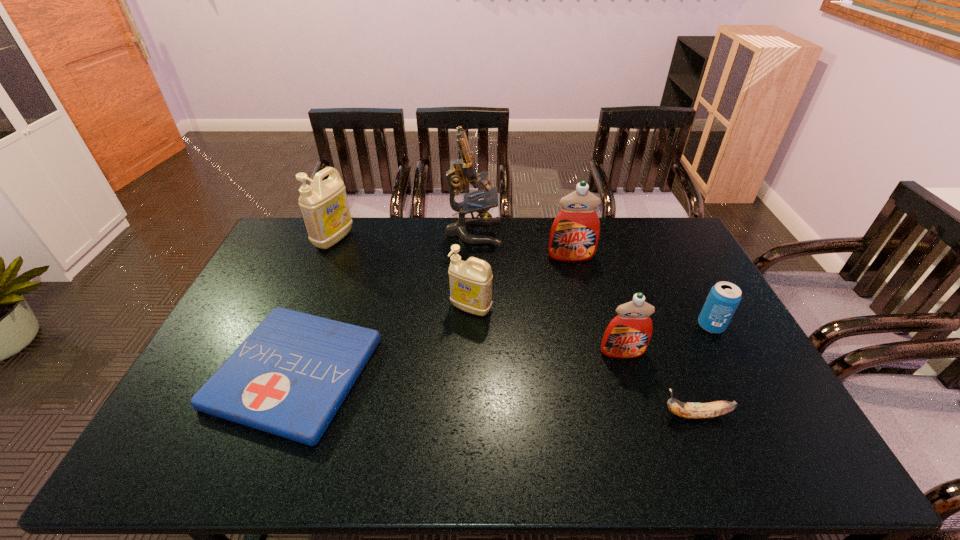
Where is `banana`? This screenshot has height=540, width=960. banana is located at coordinates (710, 409).

The height and width of the screenshot is (540, 960). Find the location of `the shortest object`. the shortest object is located at coordinates (290, 376).

Where is `blue first-aid kit`? blue first-aid kit is located at coordinates (290, 376).

At what (x,y) coordinates should I click in order to perform the action: click on free space located 0.320m at the eyepieces of the tallest object. Please return your answer as a coordinate pair (x, y). The width and height of the screenshot is (960, 540). Looking at the image, I should click on (585, 233).

This screenshot has width=960, height=540. Find the location of `vacant position located 0.220m on the right of the leftmost detergent`. vacant position located 0.220m on the right of the leftmost detergent is located at coordinates pos(410,239).

I want to click on vacant space situated on the front surface of the bigger red detergent, so click(x=580, y=292).

The image size is (960, 540). Identify the location of vacant space situated 0.100m on the right of the right beige detergent. (524, 308).

What are the coordinates of `blank space located on the front surface of the nearer red detergent` in the screenshot? It's located at (655, 456).

The height and width of the screenshot is (540, 960). Find the location of `free space located 0.160m on the front of the rightmost object`. free space located 0.160m on the front of the rightmost object is located at coordinates (740, 381).

The image size is (960, 540). Identify the location of free region located at the stem of the banana. (640, 415).